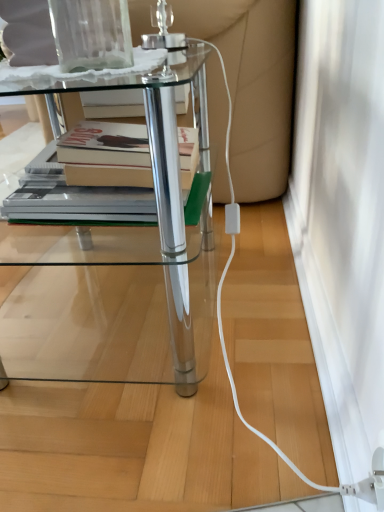
Question: Considering the relative sizes of transparent glass vase at upper center and clear glass table at center in the image provided, is transparent glass vase at upper center bigger than clear glass table at center?

Choices:
 (A) yes
 (B) no

Answer: (B)

Question: Considering the relative positions of transparent glass vase at upper center and clear glass table at center in the image provided, is transparent glass vase at upper center behind clear glass table at center?

Choices:
 (A) yes
 (B) no

Answer: (B)

Question: Could you tell me if transparent glass vase at upper center is turned towards clear glass table at center?

Choices:
 (A) no
 (B) yes

Answer: (A)

Question: Is transparent glass vase at upper center closer to the viewer compared to clear glass table at center?

Choices:
 (A) yes
 (B) no

Answer: (A)

Question: Is clear glass table at center located within transparent glass vase at upper center?

Choices:
 (A) no
 (B) yes

Answer: (A)

Question: In the image, is transparent glass vase at upper center on the left side or the right side of white matte screen door at lower right?

Choices:
 (A) right
 (B) left

Answer: (B)

Question: From a real-world perspective, is transparent glass vase at upper center positioned above or below white matte screen door at lower right?

Choices:
 (A) above
 (B) below

Answer: (A)

Question: Based on their sizes in the image, would you say transparent glass vase at upper center is bigger or smaller than white matte screen door at lower right?

Choices:
 (A) big
 (B) small

Answer: (B)

Question: In terms of height, does transparent glass vase at upper center look taller or shorter compared to white matte screen door at lower right?

Choices:
 (A) short
 (B) tall

Answer: (B)

Question: Does point (84, 45) appear closer or farther from the camera than point (124, 284)?

Choices:
 (A) farther
 (B) closer

Answer: (B)

Question: Is transparent glass vase at upper center wider or thinner than clear glass table at center?

Choices:
 (A) wide
 (B) thin

Answer: (B)

Question: Relative to clear glass table at center, is transparent glass vase at upper center in front or behind?

Choices:
 (A) front
 (B) behind

Answer: (A)

Question: Considering the positions of transparent glass vase at upper center and clear glass table at center in the image, is transparent glass vase at upper center taller or shorter than clear glass table at center?

Choices:
 (A) tall
 (B) short

Answer: (B)

Question: In the image, is white matte screen door at lower right on the left side or the right side of transparent glass vase at upper center?

Choices:
 (A) left
 (B) right

Answer: (B)

Question: In terms of height, does white matte screen door at lower right look taller or shorter compared to transparent glass vase at upper center?

Choices:
 (A) short
 (B) tall

Answer: (A)